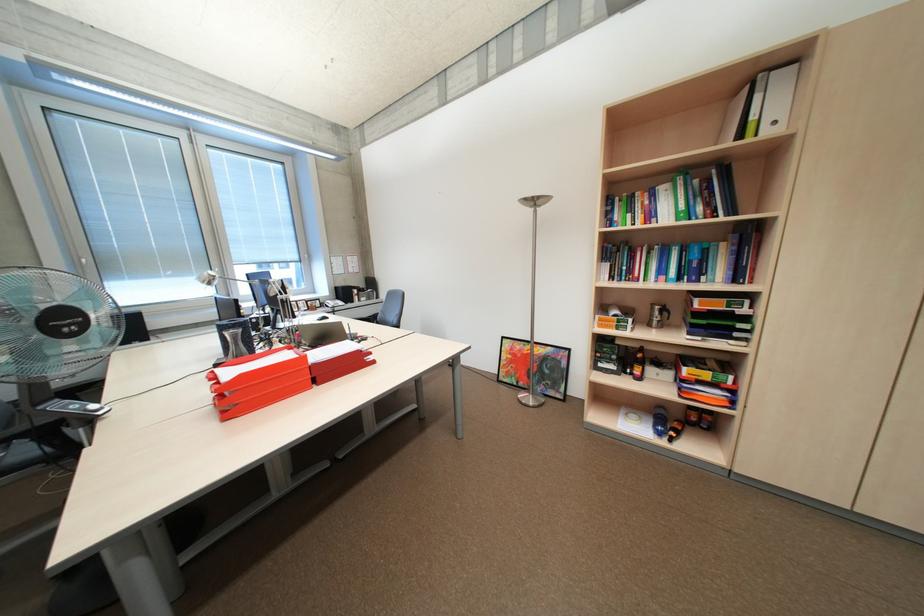
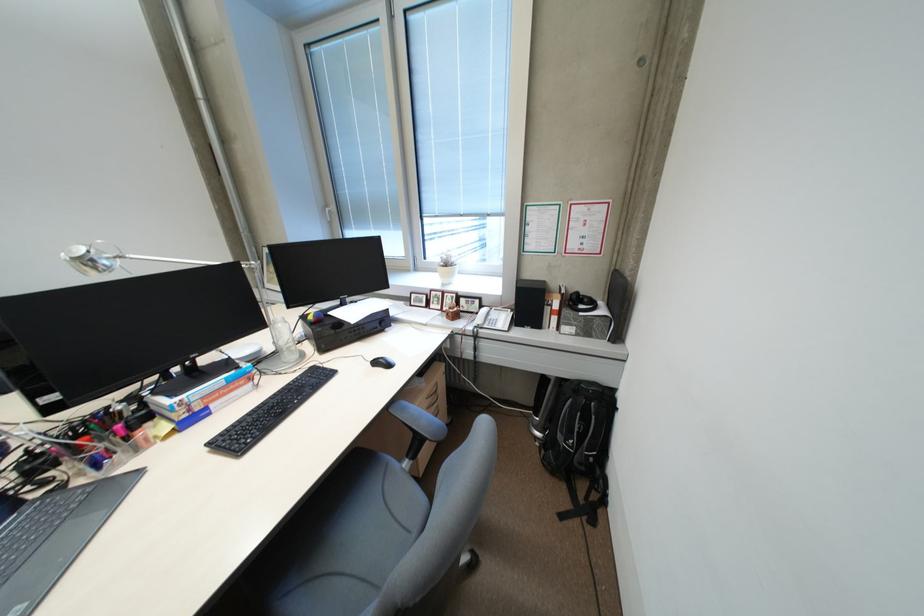
Locate, in the second image, the point that corresponds to [370,300] in the first image.

(568, 328)